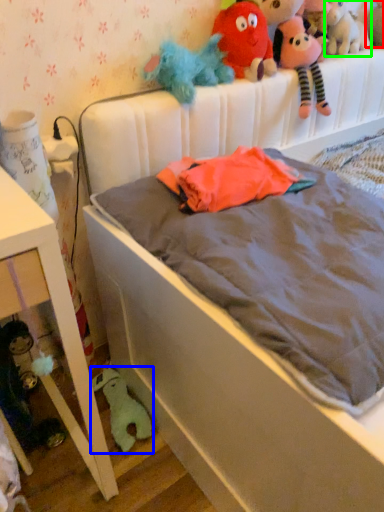
Question: Which object is positioned closest to toy (highlighted by a red box)? Select from toy (highlighted by a blue box) and toy (highlighted by a green box).

Choices:
 (A) toy
 (B) toy

Answer: (B)